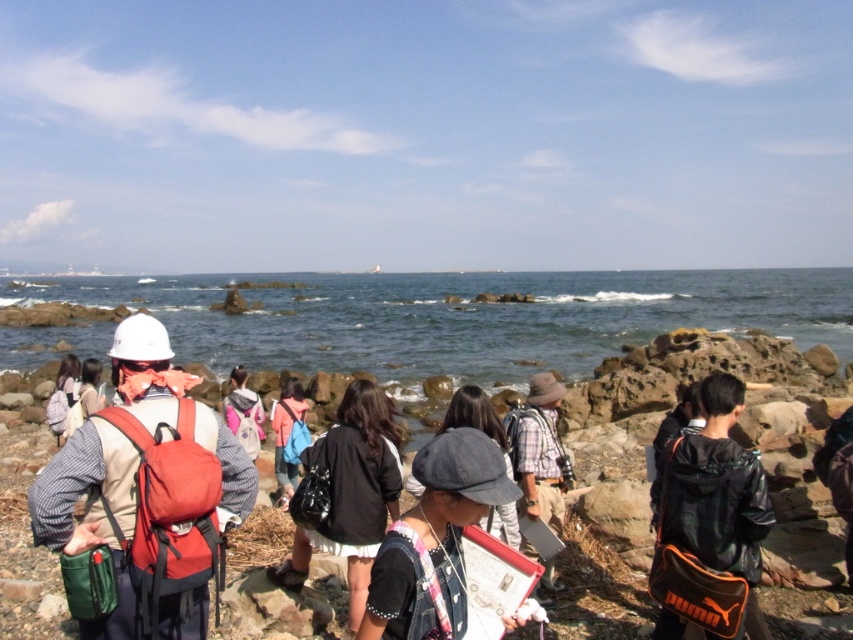
You are planning to take a photo of the clear blue water at center and the leather jacket at center from the shore. Which object appears wider in the photo?

The clear blue water at center appears wider in the photo because its width is larger than the leather jacket at center.

You are a photographer trying to capture a shot of both the matte white helmet at left and the denim hat at center. Since you want to ensure both are fully visible in the frame, which object should you adjust your focus to prioritize in terms of width to avoid cropping either?

The matte white helmet at left is wider than the denim hat at center, so you should prioritize focusing on the matte white helmet at left to ensure both fit within the frame without cropping.

In the scene shown: You are standing at the rocky shoreline and want to walk towards the ocean. There are two points marked in the image. The first point is at coordinates point (149,556) and the second point is at coordinates point (740,580). Which point should you head towards if you want to reach the ocean first?

You should head towards point (149,556) because it is in front of point (740,580), meaning it is closer to the ocean.